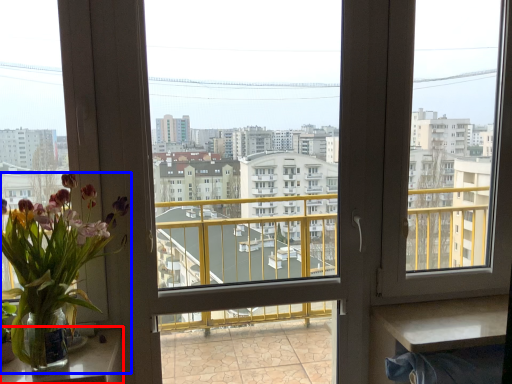
Question: Which of the following is the farthest to the observer, table (highlighted by a red box) or houseplant (highlighted by a blue box)?

Choices:
 (A) table
 (B) houseplant

Answer: (A)